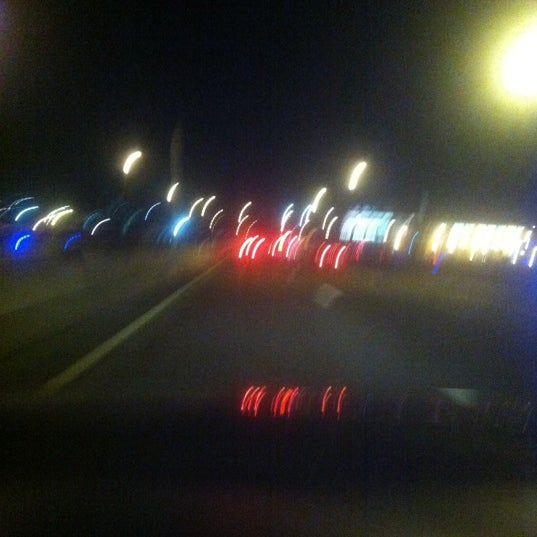
At what (x,y) coordinates should I click in order to perform the action: click on green light. Please return your answer as a coordinate pair (x, y). Looking at the image, I should click on (179, 226).